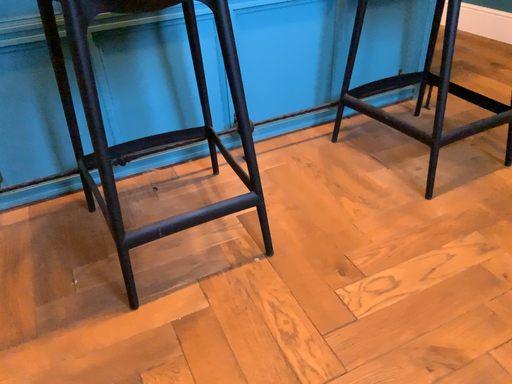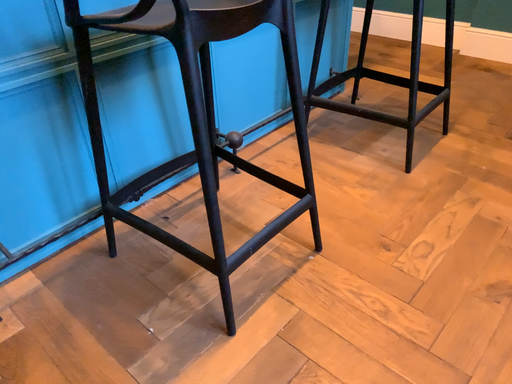
Question: Which way did the camera rotate in the video?

Choices:
 (A) rotated right
 (B) rotated left

Answer: (A)